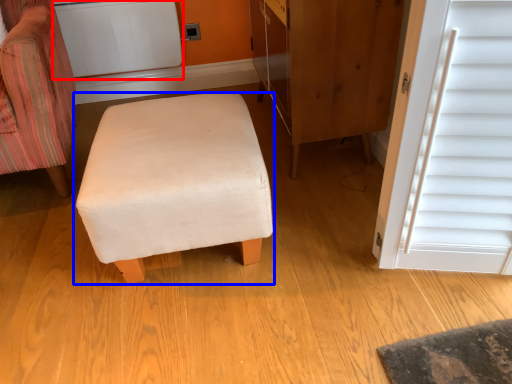
Question: Which point is closer to the camera, appliance (highlighted by a red box) or furniture (highlighted by a blue box)?

Choices:
 (A) appliance
 (B) furniture

Answer: (B)